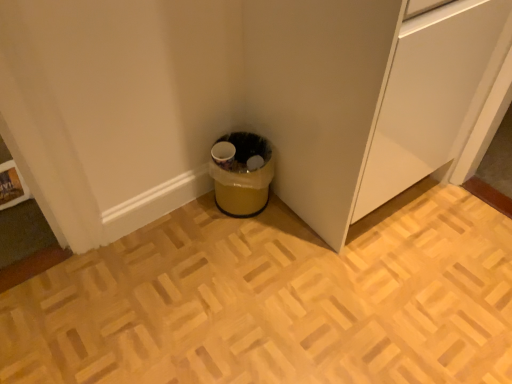
Question: Which is correct: yellow plastic trash can at lower center is inside white matte cabinet at lower center, or outside of it?

Choices:
 (A) inside
 (B) outside

Answer: (B)

Question: Would you say yellow plastic trash can at lower center is to the left or to the right of white matte cabinet at lower center in the picture?

Choices:
 (A) left
 (B) right

Answer: (A)

Question: Is yellow plastic trash can at lower center in front of or behind white matte cabinet at lower center in the image?

Choices:
 (A) behind
 (B) front

Answer: (A)

Question: Based on their positions, is white matte cabinet at lower center located to the left or right of yellow plastic trash can at lower center?

Choices:
 (A) left
 (B) right

Answer: (B)

Question: Looking at the image, does white matte cabinet at lower center seem bigger or smaller compared to yellow plastic trash can at lower center?

Choices:
 (A) big
 (B) small

Answer: (A)

Question: From the image's perspective, is white matte cabinet at lower center located above or below yellow plastic trash can at lower center?

Choices:
 (A) below
 (B) above

Answer: (B)

Question: In terms of width, does white matte cabinet at lower center look wider or thinner when compared to yellow plastic trash can at lower center?

Choices:
 (A) wide
 (B) thin

Answer: (A)